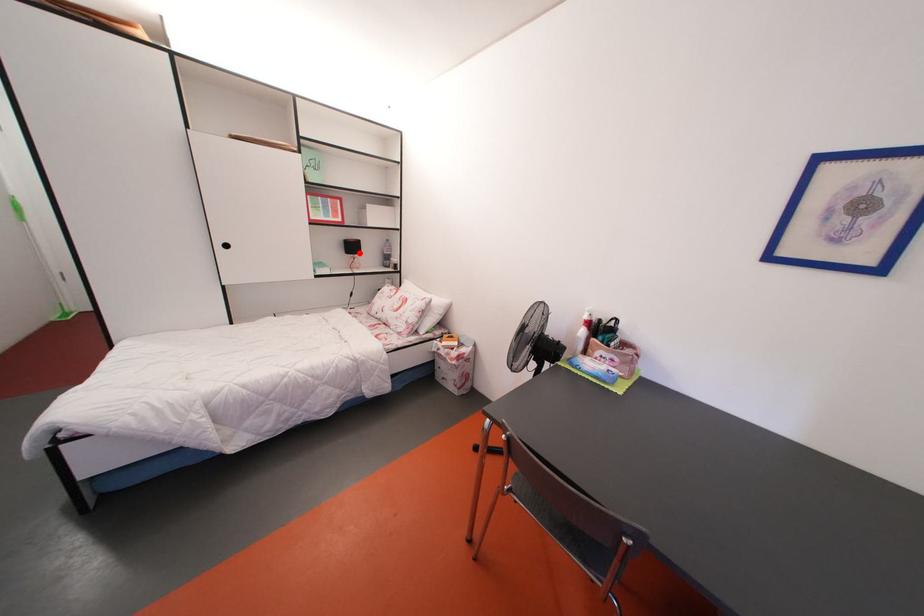
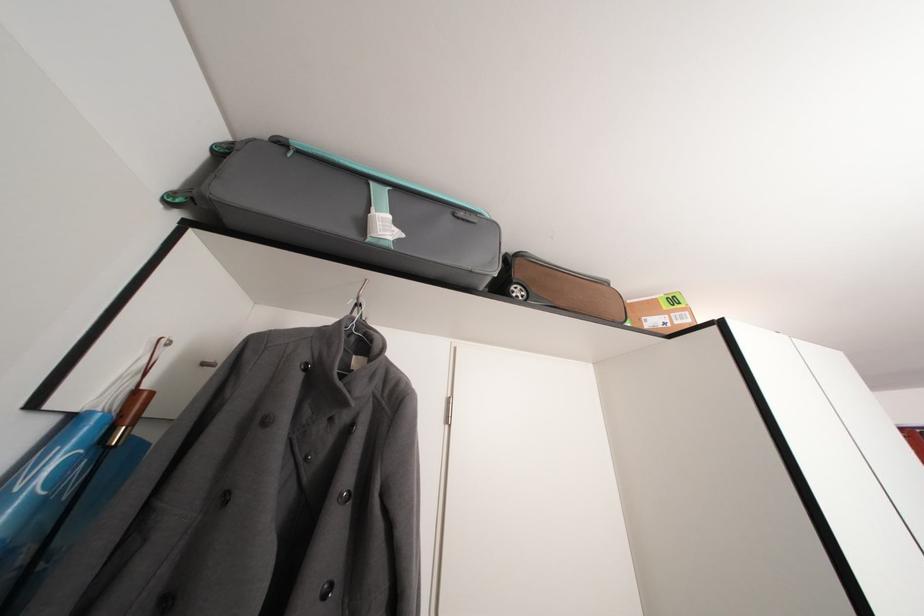
Question: I am providing you with two images of the same scene from different viewpoints. A red point is marked on the first image. At the location where the point appears in image 1, is it still visible in image 2?

Choices:
 (A) Yes
 (B) No

Answer: (B)